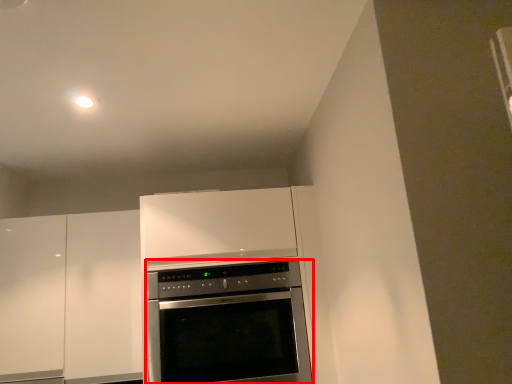
Question: Where is oven (annotated by the red box) located in relation to cabinetry in the image?

Choices:
 (A) right
 (B) left

Answer: (A)